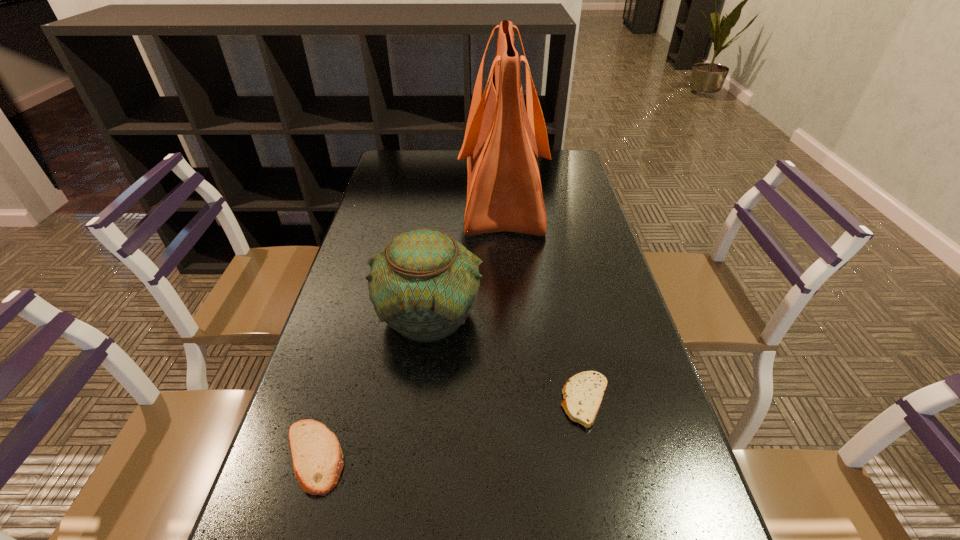
The width and height of the screenshot is (960, 540). Find the location of `free region at the far edge`. free region at the far edge is located at coordinates (455, 153).

This screenshot has width=960, height=540. I want to click on free space at the left edge, so click(368, 204).

Where is `free space at the right edge`? Image resolution: width=960 pixels, height=540 pixels. free space at the right edge is located at coordinates (630, 355).

In the image, there is a desktop. Where is `vacant space at the far left corner`? This screenshot has height=540, width=960. vacant space at the far left corner is located at coordinates (422, 153).

In order to click on vacant space at the far right corner of the desktop in this screenshot , I will do `click(557, 160)`.

Identify the location of free point between the shorter pita bread and the pottery. The image size is (960, 540). (x=508, y=358).

Identify the location of free space between the right pita bread and the taller pita bread. (x=449, y=429).

You are a GUI agent. You are given a task and a screenshot of the screen. Output one action in this format:
    pyautogui.click(x=<x>, y=<y>)
    Task: Click on the unoccupied position between the shorter pita bread and the third tallest object
    
    Given the screenshot: What is the action you would take?
    pyautogui.click(x=449, y=429)

This screenshot has width=960, height=540. Find the location of `free space between the pottery and the third tallest object`. free space between the pottery and the third tallest object is located at coordinates (372, 386).

The height and width of the screenshot is (540, 960). What are the coordinates of `vacant region between the right pita bread and the shopping bag` in the screenshot? It's located at tap(543, 298).